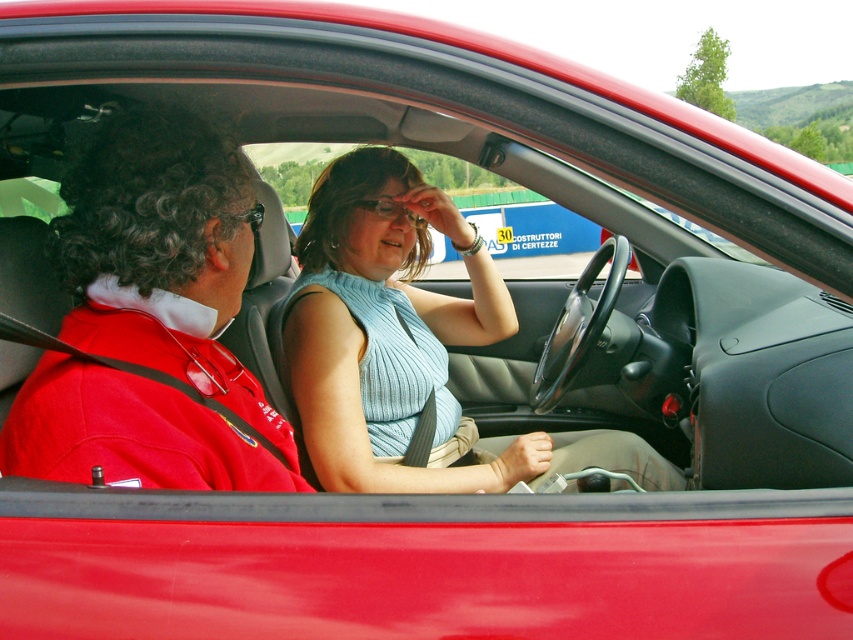
Can you confirm if red fabric jacket at left is positioned below light blue ribbed tank top at center?

No, red fabric jacket at left is not below light blue ribbed tank top at center.

Between red fabric jacket at left and light blue ribbed tank top at center, which one is positioned lower?

light blue ribbed tank top at center is below.

Who is more forward, (x=289, y=476) or (x=514, y=452)?

Positioned in front is point (x=289, y=476).

The width and height of the screenshot is (853, 640). I want to click on red fabric jacket at left, so click(x=151, y=320).